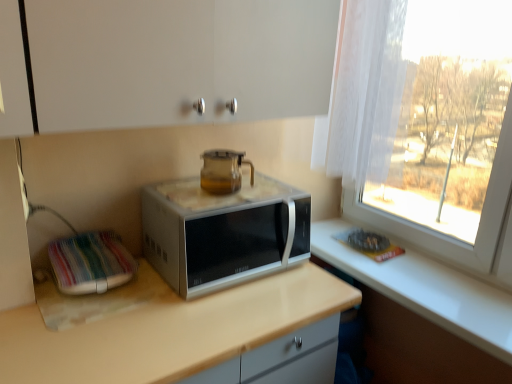
Question: Considering the relative positions of beige laminate countertop at center and satin silver microwave at center in the image provided, is beige laminate countertop at center to the left or to the right of satin silver microwave at center?

Choices:
 (A) right
 (B) left

Answer: (B)

Question: From their relative heights in the image, would you say beige laminate countertop at center is taller or shorter than satin silver microwave at center?

Choices:
 (A) short
 (B) tall

Answer: (B)

Question: Estimate the real-world distances between objects in this image. Which object is farther from the transparent glass teapot at center?

Choices:
 (A) satin silver microwave at center
 (B) beige laminate countertop at center
 (C) white fabric at left

Answer: (B)

Question: Which is nearer to the satin silver microwave at center?

Choices:
 (A) transparent glass teapot at center
 (B) white fabric at left
 (C) beige laminate countertop at center

Answer: (A)